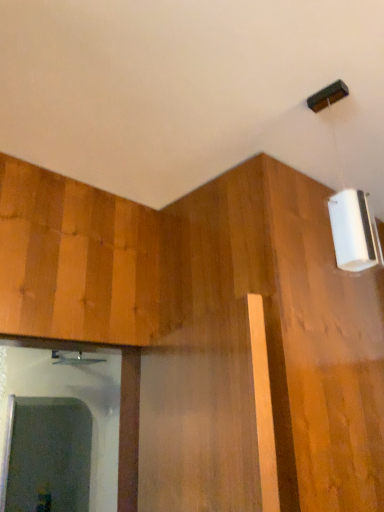
Describe the element at coordinates (353, 226) in the screenshot. I see `black plastic lamp at upper right` at that location.

In order to click on black plastic lamp at upper right in this screenshot , I will do `click(353, 226)`.

Locate an element on the screen. black plastic lamp at upper right is located at coordinates (353, 226).